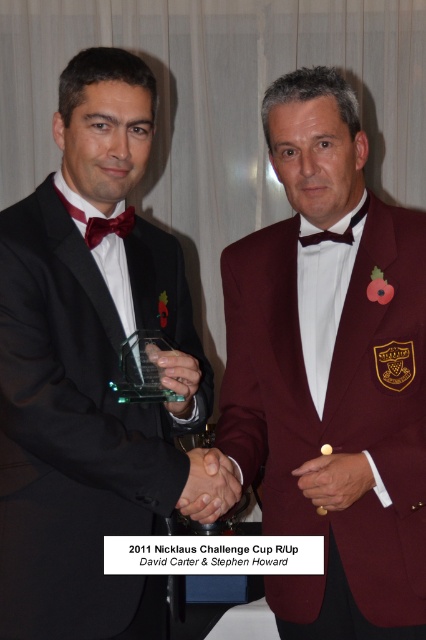
You are a photographer at a formal event. You need to position a spotlight on the maroon woolen blazer at center and the matte red bow tie at left. Since the spotlight can only illuminate one object at a time, which object should you light first if you want to capture the one that is positioned to the right?

The maroon woolen blazer at center is to the right of the matte red bow tie at left, so you should light the maroon woolen blazer at center first to capture the one on the right.

You are a photographer trying to capture a detailed closeup of the award held by the man on the left. You have two focus points available at coordinates point (x=351, y=406) and point (x=100, y=227). Which focus point should you choose to ensure the award is in sharp focus?

You should choose point (x=351, y=406) because it is closer to the viewer than point (x=100, y=227), so focusing there will ensure the award is sharp.

Based on the scene description, which object is taller between the maroon woolen blazer at center and the matte red bow tie at left?

The maroon woolen blazer at center is taller than the matte red bow tie at left according to the description.